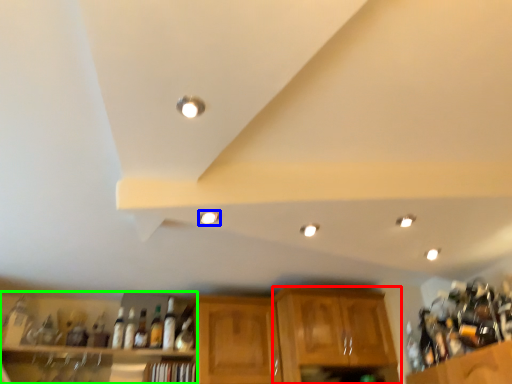
Question: Estimate the real-world distances between objects in this image. Which object is closer to cabinetry (highlighted by a red box), lighting (highlighted by a blue box) or shelf (highlighted by a green box)?

Choices:
 (A) lighting
 (B) shelf

Answer: (B)